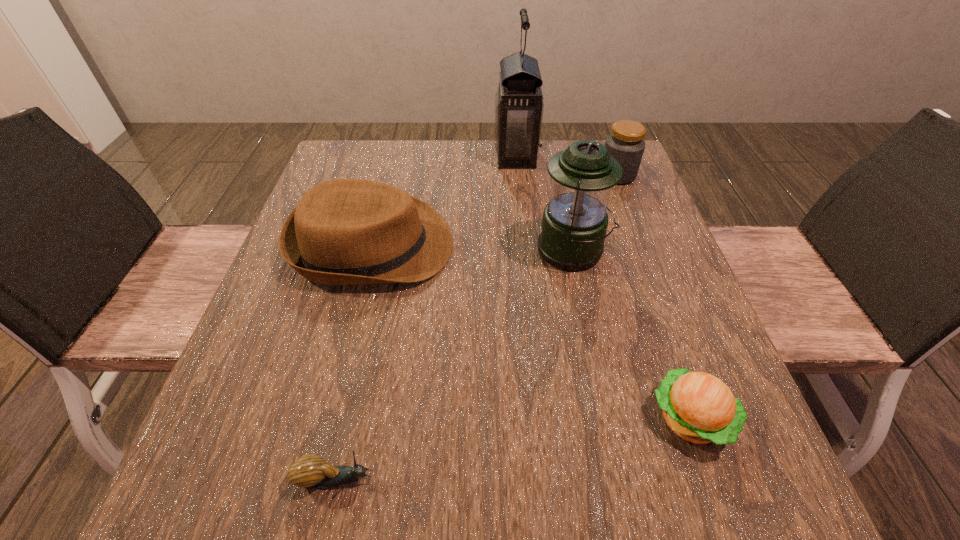
Where is `free location that satisfies the following two spatial constraints: 1. on the front-facing side of the fedora; 2. on the left side of the second shortest object`? The height and width of the screenshot is (540, 960). free location that satisfies the following two spatial constraints: 1. on the front-facing side of the fedora; 2. on the left side of the second shortest object is located at coordinates (329, 418).

Locate an element on the screen. Image resolution: width=960 pixels, height=540 pixels. blank area in the image that satisfies the following two spatial constraints: 1. on the front side of the fifth shortest object; 2. on the right side of the hamburger is located at coordinates (609, 418).